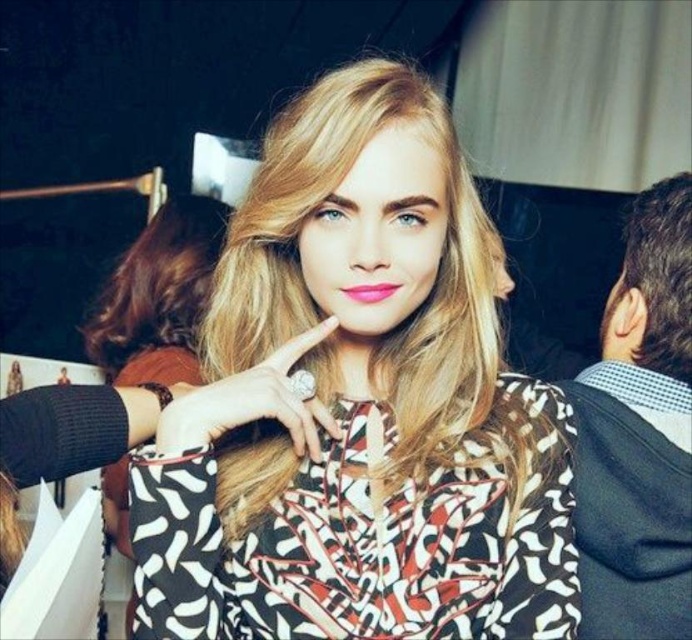
You are a photographer setting up a shot for a fashion magazine. You need to ensure that the printed fabric blouse at center and the dark brown curly hair at right are both visible in the frame. Based on their positions, which object should you focus on first to capture both elements effectively?

The printed fabric blouse at center is located below dark brown curly hair at right. To capture both elements effectively, you should focus on the dark brown curly hair at right first, as it is positioned higher up, allowing the blouse to naturally fall into the frame below.

You are at a party and want to take a photo of the dark brown curly hair at right without the black textured hoodie at right blocking it. How can you adjust your position to achieve this?

Move to the side so that the black textured hoodie at right is no longer in front of the dark brown curly hair at right, as the hoodie is currently blocking the view of the hair.

You are at a party and want to take a photo of the black textured hoodie at right and the dark brown curly hair at right. Which one should you focus on first if you want to capture both in one frame without moving the camera?

You should focus on the black textured hoodie at right first because it is closer to the camera than the dark brown curly hair at right, which is further away. This way, both will be in focus within the same frame.